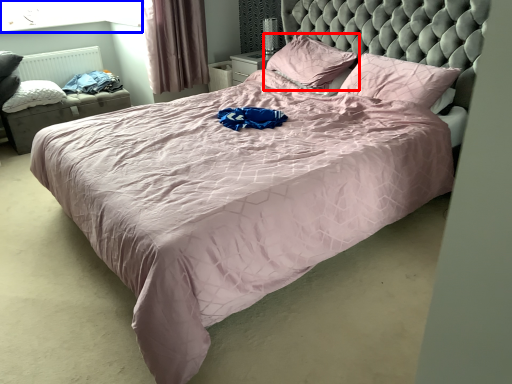
Question: Which point is closer to the camera, pillow (highlighted by a red box) or window screen (highlighted by a blue box)?

Choices:
 (A) pillow
 (B) window screen

Answer: (A)